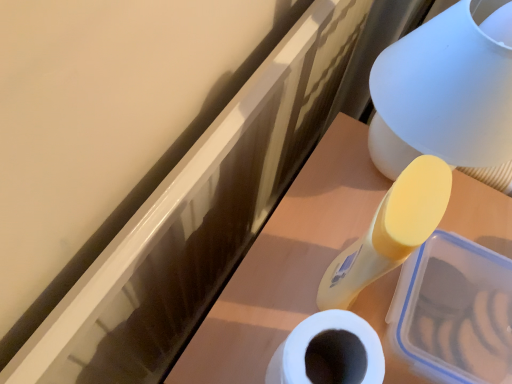
Question: Does translucent plastic container at upper right have a lesser width compared to matte white table lamp at upper right?

Choices:
 (A) yes
 (B) no

Answer: (B)

Question: Is translucent plastic container at upper right to the right of matte white table lamp at upper right from the viewer's perspective?

Choices:
 (A) no
 (B) yes

Answer: (A)

Question: From a real-world perspective, is translucent plastic container at upper right under matte white table lamp at upper right?

Choices:
 (A) no
 (B) yes

Answer: (B)

Question: Is matte white table lamp at upper right surrounded by translucent plastic container at upper right?

Choices:
 (A) yes
 (B) no

Answer: (B)

Question: Is translucent plastic container at upper right in front of matte white table lamp at upper right?

Choices:
 (A) no
 (B) yes

Answer: (A)

Question: Based on their sizes in the image, would you say matte white table lamp at upper right is bigger or smaller than white matte toilet paper at lower center?

Choices:
 (A) big
 (B) small

Answer: (A)

Question: Considering their positions, is matte white table lamp at upper right located in front of or behind white matte toilet paper at lower center?

Choices:
 (A) behind
 (B) front

Answer: (B)

Question: From the image's perspective, is matte white table lamp at upper right above or below white matte toilet paper at lower center?

Choices:
 (A) below
 (B) above

Answer: (B)

Question: In terms of width, does matte white table lamp at upper right look wider or thinner when compared to white matte toilet paper at lower center?

Choices:
 (A) thin
 (B) wide

Answer: (B)

Question: From the image's perspective, is translucent plastic container at upper right above or below matte white table lamp at upper right?

Choices:
 (A) below
 (B) above

Answer: (A)

Question: Is translucent plastic container at upper right in front of or behind matte white table lamp at upper right in the image?

Choices:
 (A) front
 (B) behind

Answer: (B)

Question: Considering the positions of point (287, 281) and point (438, 115), is point (287, 281) closer or farther from the camera than point (438, 115)?

Choices:
 (A) closer
 (B) farther

Answer: (B)

Question: From a real-world perspective, is translucent plastic container at upper right above or below matte white table lamp at upper right?

Choices:
 (A) above
 (B) below

Answer: (B)

Question: Considering the positions of point (295, 365) and point (458, 231), is point (295, 365) closer or farther from the camera than point (458, 231)?

Choices:
 (A) closer
 (B) farther

Answer: (A)

Question: Do you think white matte toilet paper at lower center is within translucent plastic container at upper right, or outside of it?

Choices:
 (A) outside
 (B) inside

Answer: (A)